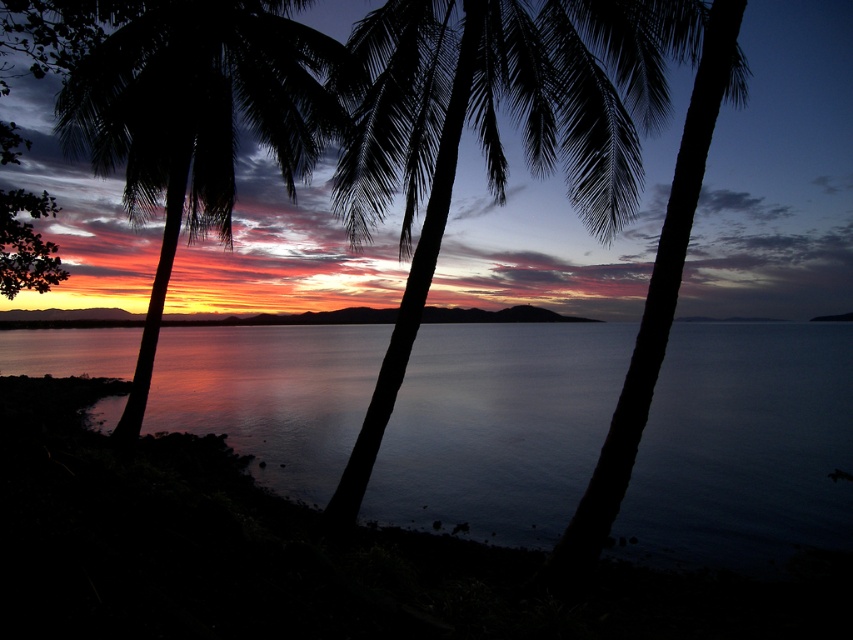
You are a photographer standing at the edge of the coast, aiming to capture the sunset reflection on the silvery reflective water at center. Given that your camera can only focus on objects within a 0.5 unit radius from the center point, will the reflection be in focus?

The silvery reflective water at center is positioned at point [743,445]. Since the camera can focus within a 0.5 unit radius from the center, the reflection will be in focus as the distance from the center to the water is less than 0.5 units.

You are standing at the point with coordinates point (x=743, y=445) in the image. What do you see around you?

You are standing at point (x=743, y=445), which corresponds to silvery reflective water at center. The silvery reflective water at center is part of the serene sunset scene at a coastal location with three silhouetted palm trees in the foreground and vibrant sky colors transitioning from deep purples and blues at the top to fiery oranges and reds near the horizon.

From the picture: You are standing at the point labeled as point (495, 131) in the image. Looking towards the sunset, which direction should you face to see the black leafy palm tree at center?

You should face towards the center of the image because the black leafy palm tree at center is located at point (495, 131), which is the center position in the coordinate system.